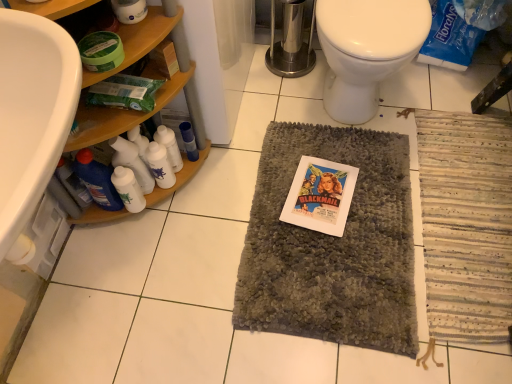
Where is `blank space situated above gray shaggy mat at center (from a real-world perspective)`? Image resolution: width=512 pixels, height=384 pixels. blank space situated above gray shaggy mat at center (from a real-world perspective) is located at coordinates (333, 221).